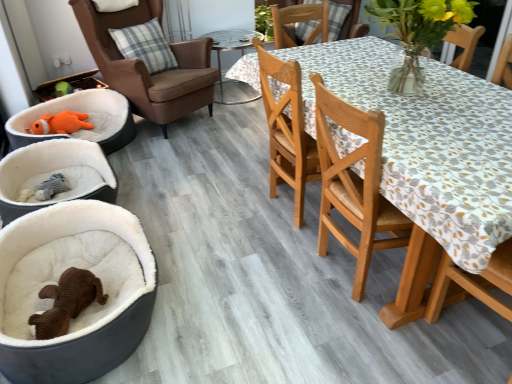
What do you see at coordinates (74, 233) in the screenshot? I see `white plush dog bed at lower left` at bounding box center [74, 233].

Measure the distance between white plush dog bed at lower left and camera.

The depth of white plush dog bed at lower left is 1.48 meters.

Describe the element at coordinates (232, 49) in the screenshot. Image resolution: width=512 pixels, height=384 pixels. I see `transparent glass table at center` at that location.

You are a GUI agent. You are given a task and a screenshot of the screen. Output one action in this format:
    pyautogui.click(x=<x>, y=<y>)
    Task: Click on the transparent glass table at center
    
    Given the screenshot: What is the action you would take?
    pyautogui.click(x=232, y=49)

You are a GUI agent. You are given a task and a screenshot of the screen. Output one action in this format:
    pyautogui.click(x=<x>, y=<y>)
    Task: Click on the plaid fabric pillow at upper left
    The height and width of the screenshot is (384, 512).
    Given the screenshot: What is the action you would take?
    (x=145, y=46)

Is brown leather armchair at upper left, which is the first chair from left to right, looking in the opposite direction of orange plush toy at left?

No, orange plush toy at left is not at the back of brown leather armchair at upper left, which is the first chair from left to right.

Considering the relative positions of brown leather armchair at upper left, which ranks as the 1th chair in back-to-front order, and orange plush toy at left in the image provided, is brown leather armchair at upper left, which ranks as the 1th chair in back-to-front order, to the right of orange plush toy at left from the viewer's perspective?

Yes, brown leather armchair at upper left, which ranks as the 1th chair in back-to-front order, is to the right of orange plush toy at left.

Does brown leather armchair at upper left, marked as the 2th chair in a front-to-back arrangement, come behind orange plush toy at left?

That is False.

Between brown leather armchair at upper left, which is the first chair from left to right, and orange plush toy at left, which one has larger size?

brown leather armchair at upper left, which is the first chair from left to right.

Which object is more forward, transparent glass table at center or orange plush toy at left?

orange plush toy at left is closer to the camera.

Is transparent glass table at center inside or outside of orange plush toy at left?

transparent glass table at center is spatially situated outside orange plush toy at left.

From their relative heights in the image, would you say transparent glass table at center is taller or shorter than orange plush toy at left?

Clearly, transparent glass table at center is taller compared to orange plush toy at left.

Considering the sizes of objects wooden chair at center, arranged as the 1th chair when viewed from the front, and orange plush toy at left in the image provided, who is shorter, wooden chair at center, arranged as the 1th chair when viewed from the front, or orange plush toy at left?

With less height is orange plush toy at left.

Which is in front, point (263, 58) or point (48, 84)?

The point (263, 58) is in front.

From the image's perspective, which one is positioned lower, wooden chair at center, which is counted as the 2th chair, starting from the back, or orange plush toy at left?

wooden chair at center, which is counted as the 2th chair, starting from the back, is shown below in the image.

Can we say wooden chair at center, the 2th chair viewed from the left, lies outside orange plush toy at left?

wooden chair at center, the 2th chair viewed from the left, is positioned outside orange plush toy at left.

Is orange plush toy at left with wooden chair at center, arranged as the 1th chair when viewed from the front?

No, orange plush toy at left is not with wooden chair at center, arranged as the 1th chair when viewed from the front.

Is orange plush toy at left at the left side of wooden chair at center, the 2th chair viewed from the left?

Indeed, orange plush toy at left is positioned on the left side of wooden chair at center, the 2th chair viewed from the left.

Which object is thinner, orange plush toy at left or wooden chair at center, arranged as the 1th chair when viewed from the front?

With smaller width is wooden chair at center, arranged as the 1th chair when viewed from the front.

From the image's perspective, which one is positioned lower, orange plush toy at left or wooden chair at center, which ranks as the 1th chair in right-to-left order?

wooden chair at center, which ranks as the 1th chair in right-to-left order, appears lower in the image.

Considering the relative sizes of white plush pet bed at left and orange plush toy at left in the image provided, is white plush pet bed at left thinner than orange plush toy at left?

Incorrect, the width of white plush pet bed at left is not less than that of orange plush toy at left.

From the image's perspective, between white plush pet bed at left and orange plush toy at left, who is located below?

white plush pet bed at left, from the image's perspective.

Is point (5, 221) less distant than point (100, 84)?

Yes, point (5, 221) is in front of point (100, 84).

Is white plush pet bed at left taller than orange plush toy at left?

No, white plush pet bed at left is not taller than orange plush toy at left.

Is brown leather armchair at upper left, which is the first chair from left to right, positioned in front of white plush pet bed at left?

No, brown leather armchair at upper left, which is the first chair from left to right, is further to the viewer.

Is brown leather armchair at upper left, the 2th chair positioned from the right, wider or thinner than white plush pet bed at left?

Considering their sizes, brown leather armchair at upper left, the 2th chair positioned from the right, looks broader than white plush pet bed at left.

Is point (203, 74) more distant than point (96, 168)?

Yes, it is behind point (96, 168).

What's the angular difference between white plush pet bed at left and transparent glass table at center's facing directions?

The facing directions of white plush pet bed at left and transparent glass table at center are 86.7 degrees apart.

Would you consider white plush pet bed at left to be distant from transparent glass table at center?

white plush pet bed at left is positioned a significant distance from transparent glass table at center.

How distant is white plush pet bed at left from transparent glass table at center?

They are 1.75 meters apart.

Between white plush pet bed at left and transparent glass table at center, which one has more height?

Standing taller between the two is transparent glass table at center.

Identify the location of chair located above the orange plush toy at left (from the image's perspective). This screenshot has height=384, width=512. (145, 66).

I want to click on laundry basket to the left of transparent glass table at center, so click(70, 85).

Looking at this image, estimate the real-world distances between objects in this image. Which object is closer to white plush pet bed at left, orange plush toy at left or transparent glass table at center?

orange plush toy at left lies closer to white plush pet bed at left than the other object.

When comparing their distances from white plush pet bed at left, does transparent glass table at center or white plush dog bed at lower left seem further?

Among the two, transparent glass table at center is located further to white plush pet bed at left.

Looking at the image, which one is located further to white plush pet bed at left, wooden chair at center, arranged as the 1th chair when viewed from the front, or orange plush toy at left?

wooden chair at center, arranged as the 1th chair when viewed from the front, is further to white plush pet bed at left.

Looking at the image, which one is located further to wooden table at right, transparent glass table at center or brown leather armchair at upper left, the 2th chair positioned from the right?

transparent glass table at center is further to wooden table at right.

Considering their positions, is wooden table at right positioned further to brown leather armchair at upper left, which ranks as the 1th chair in back-to-front order, than transparent glass table at center?

Among the two, wooden table at right is located further to brown leather armchair at upper left, which ranks as the 1th chair in back-to-front order.

Based on their spatial positions, is orange plush toy at left or wooden chair at center, arranged as the 1th chair when viewed from the front, further from brown leather armchair at upper left, the 2th chair positioned from the right?

wooden chair at center, arranged as the 1th chair when viewed from the front, is further to brown leather armchair at upper left, the 2th chair positioned from the right.

From the image, which object appears to be farther from white plush dog bed at lower left, orange plush toy at left or wooden table at right?

orange plush toy at left is further to white plush dog bed at lower left.

Estimate the real-world distances between objects in this image. Which object is further from wooden table at right, white plush pet bed at left or transparent glass table at center?

transparent glass table at center lies further to wooden table at right than the other object.

This screenshot has width=512, height=384. What are the coordinates of `pillow between orange plush toy at left and wooden chair at center, which is counted as the 2th chair, starting from the back, from left to right` in the screenshot? It's located at 145,46.

Where is `flowerpot between white plush pet bed at left and wooden chair at center, the 2th chair viewed from the left`? The image size is (512, 384). flowerpot between white plush pet bed at left and wooden chair at center, the 2th chair viewed from the left is located at coordinates (74, 233).

Where is `pillow located between white plush pet bed at left and wooden table at right in the left-right direction`? The image size is (512, 384). pillow located between white plush pet bed at left and wooden table at right in the left-right direction is located at coordinates (145, 46).

At what (x,y) coordinates should I click in order to perform the action: click on table located between orange plush toy at left and wooden chair at center, arranged as the 1th chair when viewed from the front, in the left-right direction. Please return your answer as a coordinate pair (x, y). Looking at the image, I should click on (232, 49).